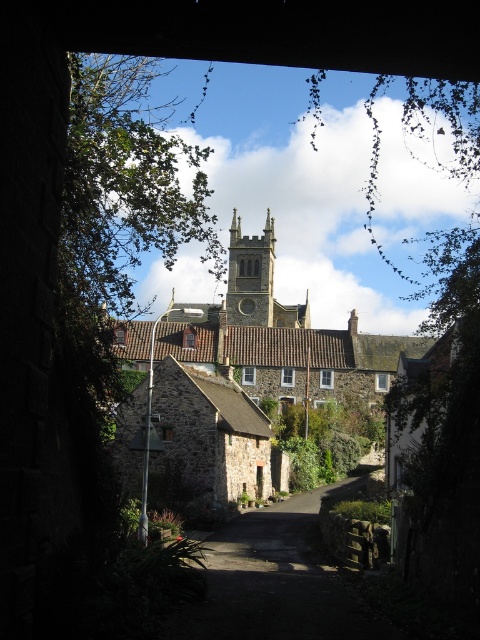
You are standing at the entrance of the alley and want to walk towards the village. There are two points marked in the image, point (236, 296) and point (237, 256). Which point should you aim for if you want to take the path that is closer to you?

You should aim for point (236, 296) because it is closer to the viewer than point (237, 256).

You are a tourist standing at the entrance of the alleyway. You see the brown tiled roof church at center and the smooth stone tower at center. Which one do you think is taller?

The brown tiled roof church at center is much taller than the smooth stone tower at center.